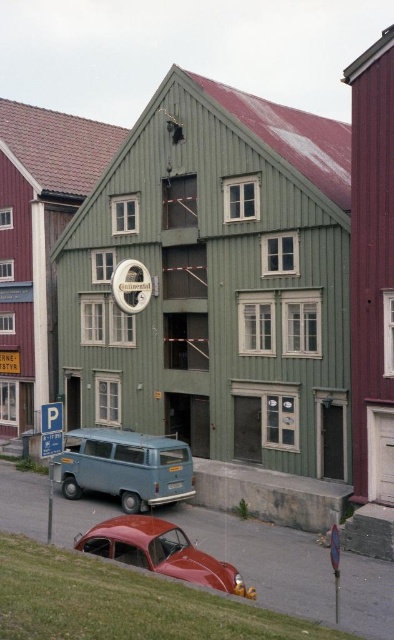
You are a pedestrian standing in front of the building and want to cross the street. There is a matte blue van at lower left and a shiny red car at lower left. Which vehicle is blocking your path more?

The matte blue van at lower left is positioned over shiny red car at lower left, so the matte blue van at lower left is blocking the path more.

You are a delivery person needing to park your vehicle in the parking lot behind the green building. The parking spots there have a maximum vehicle length of 5 meters. Given that the matte blue van at lower left is larger than the shiny red car at lower left, which vehicle would you choose to park there if your delivery van is 5.5 meters long?

The shiny red car at lower left is smaller than the matte blue van at lower left. Since your delivery van is 5.5 meters long, which exceeds the parking spot limit of 5 meters, neither vehicle would fit. You should find a larger parking area.

You are a pedestrian standing on the sidewalk in front of the building. You see the matte blue van at lower left and the shiny red car at lower left. Which vehicle is closer to you?

The matte blue van at lower left is closer to you because it is further to the viewer than the shiny red car at lower left, meaning it is positioned nearer in the scene.